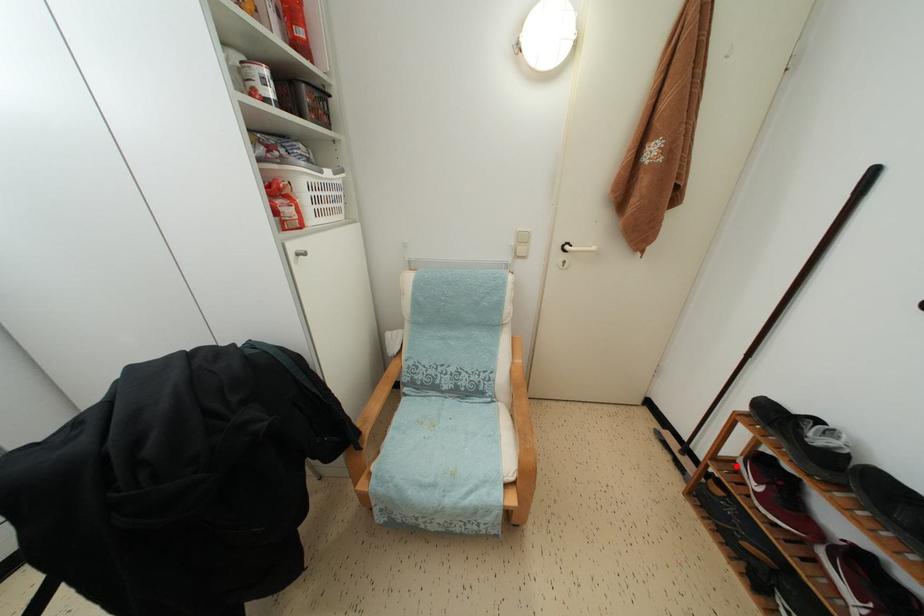
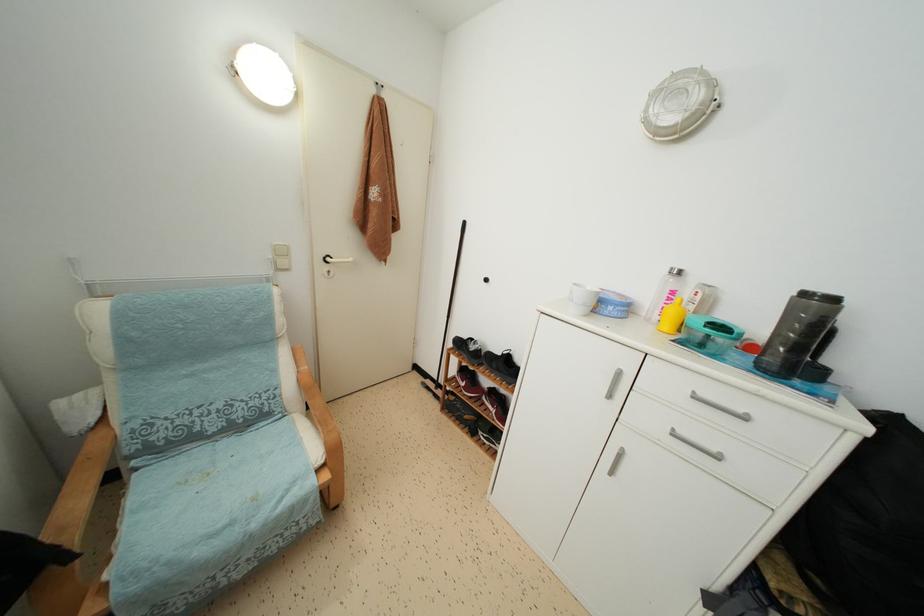
The point at the highlighted location is marked in the first image. Where is the corresponding point in the second image?

(457, 383)